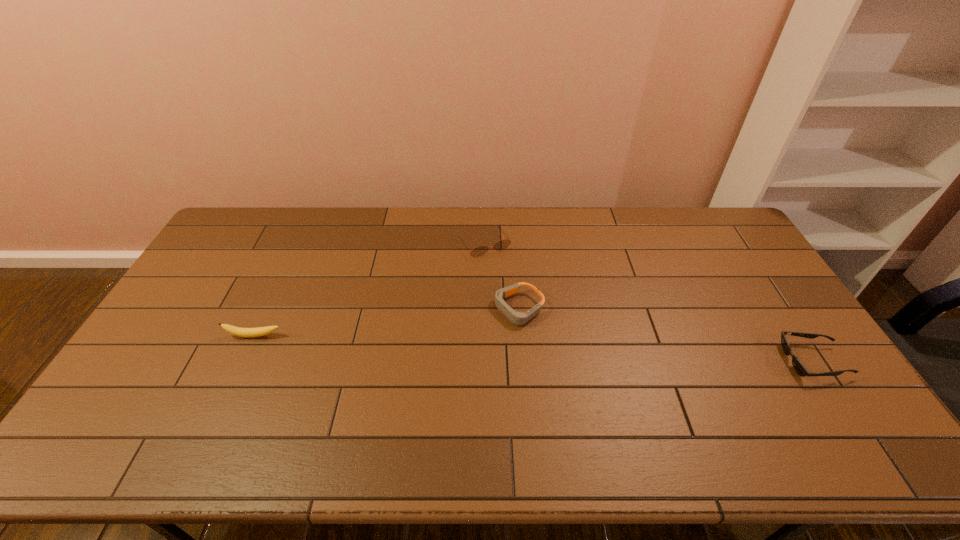
Identify the location of vacant spot on the desktop that is between the banana and the nearer sunglasses and is positioned on the front and back of the goggles. (453, 345).

In order to click on free space on the desktop that is between the leftmost object and the nearest object and is positioned on the face of the farther sunglasses in this screenshot , I will do 558,349.